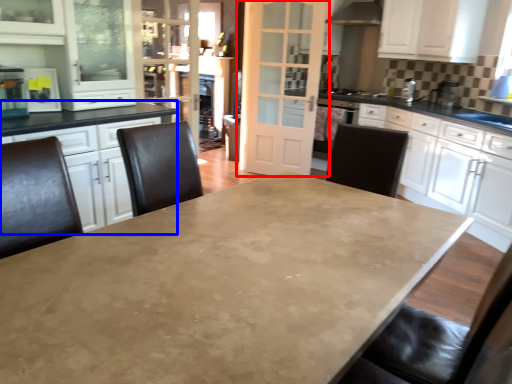
Question: Among these objects, which one is farthest to the camera, door (highlighted by a red box) or counter top (highlighted by a blue box)?

Choices:
 (A) door
 (B) counter top

Answer: (A)